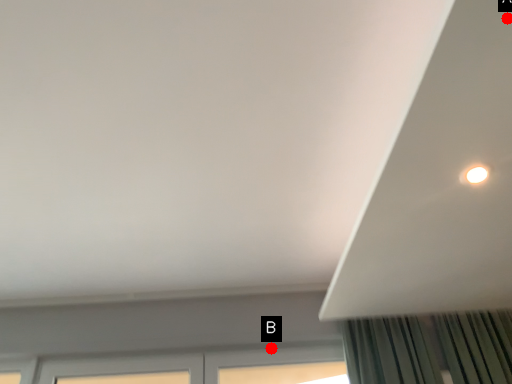
Question: Two points are circled on the image, labeled by A and B beside each circle. Which point appears farthest from the camera in this image?

Choices:
 (A) A is further
 (B) B is further

Answer: (B)